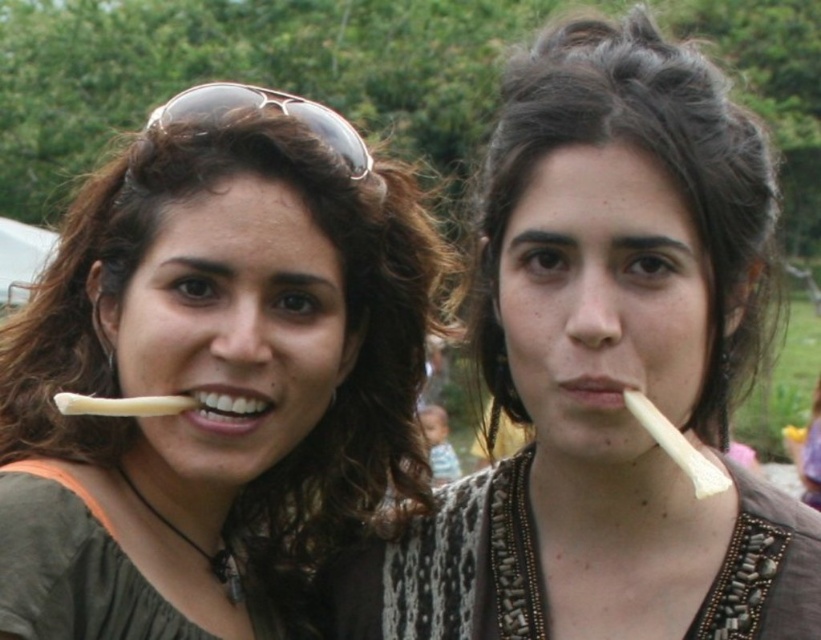
You are at a party and need to choose between the matte white toothpick at center and the white glossy toothpick at lower left to hold your snack. Which one is taller?

The white glossy toothpick at lower left is taller than the matte white toothpick at center.

You are a photographer standing at the camera position. You want to take a closeup shot of the brown reflective sunglasses at upper left. Considering the distance between you and the sunglasses, is it feasible to capture a clear closeup without moving closer?

The distance between the brown reflective sunglasses at upper left and the camera is 4.15 meters. Since this distance is relatively far, capturing a clear closeup without moving closer may be challenging unless using a telephoto lens with sufficient zoom capability.